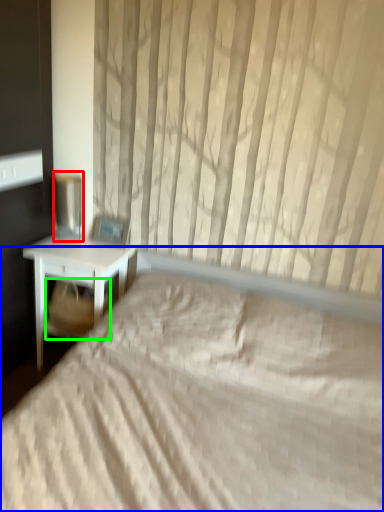
Question: Which is farther away from table lamp (highlighted by a red box)? bed (highlighted by a blue box) or swivel chair (highlighted by a green box)?

Choices:
 (A) bed
 (B) swivel chair

Answer: (A)